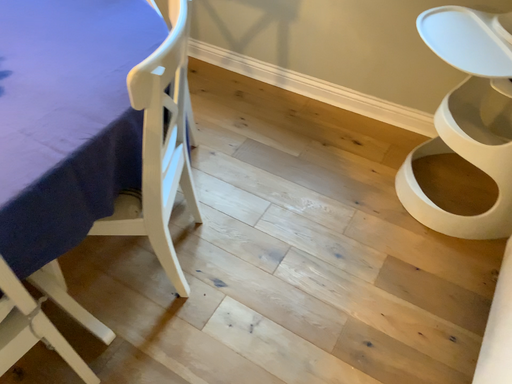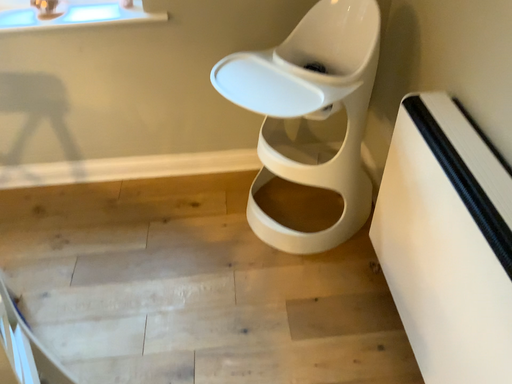
Question: How did the camera likely rotate when shooting the video?

Choices:
 (A) rotated downward
 (B) rotated upward

Answer: (B)